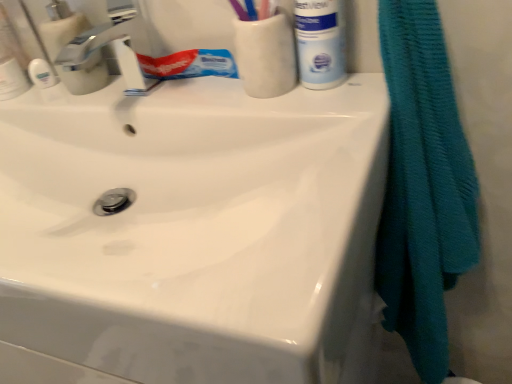
Question: Can you confirm if teal textured towel at right is shorter than white matte mouthwash at upper right?

Choices:
 (A) yes
 (B) no

Answer: (B)

Question: Can you confirm if teal textured towel at right is thinner than white matte mouthwash at upper right?

Choices:
 (A) yes
 (B) no

Answer: (B)

Question: Is teal textured towel at right positioned with its back to white matte mouthwash at upper right?

Choices:
 (A) no
 (B) yes

Answer: (A)

Question: Does teal textured towel at right have a greater height compared to white matte mouthwash at upper right?

Choices:
 (A) no
 (B) yes

Answer: (B)

Question: Can you confirm if teal textured towel at right is smaller than white matte mouthwash at upper right?

Choices:
 (A) no
 (B) yes

Answer: (A)

Question: Does teal textured towel at right have a larger size compared to white matte mouthwash at upper right?

Choices:
 (A) no
 (B) yes

Answer: (B)

Question: From a real-world perspective, is white matte mouthwash at upper right physically above teal textured towel at right?

Choices:
 (A) no
 (B) yes

Answer: (B)

Question: Is white matte mouthwash at upper right positioned far away from teal textured towel at right?

Choices:
 (A) no
 (B) yes

Answer: (A)

Question: From the image's perspective, would you say white matte mouthwash at upper right is positioned over teal textured towel at right?

Choices:
 (A) yes
 (B) no

Answer: (A)

Question: Is white matte mouthwash at upper right shorter than teal textured towel at right?

Choices:
 (A) no
 (B) yes

Answer: (B)

Question: Is white matte mouthwash at upper right behind teal textured towel at right?

Choices:
 (A) no
 (B) yes

Answer: (B)

Question: Is white matte mouthwash at upper right beside teal textured towel at right?

Choices:
 (A) yes
 (B) no

Answer: (B)

Question: Considering their positions, is white matte mouthwash at upper right located in front of or behind teal textured towel at right?

Choices:
 (A) behind
 (B) front

Answer: (A)